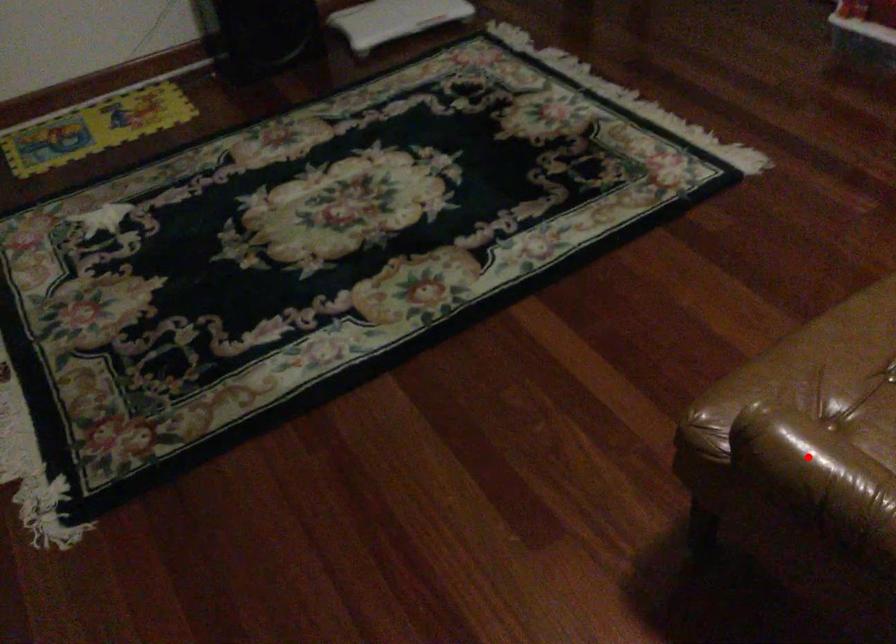
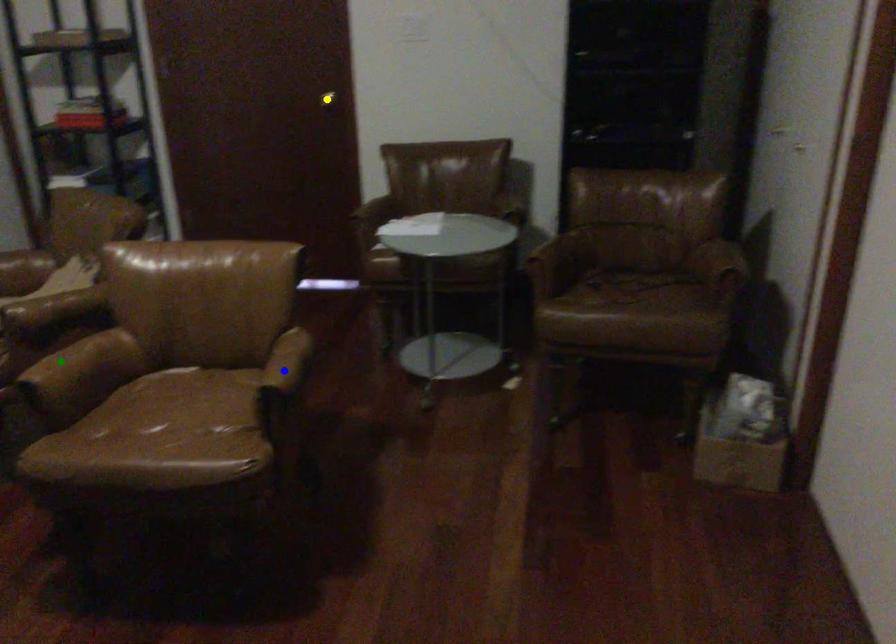
Question: I am providing you with two images of the same scene from different viewpoints. A red point is marked on the first image. You are given multiple points on the second image. Which point in image 2 represents the same 3d spot as the red point in image 1?

Choices:
 (A) yellow point
 (B) green point
 (C) blue point

Answer: (C)